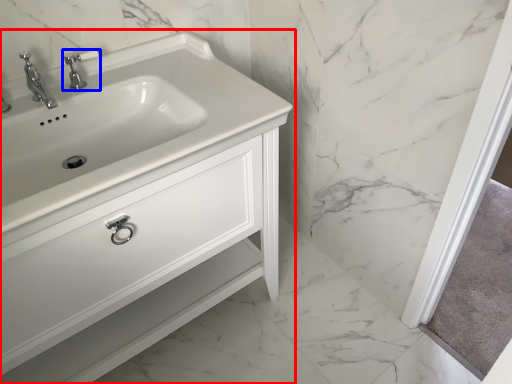
Question: Which of the following is the closest to the observer, bathroom cabinet (highlighted by a red box) or tap (highlighted by a blue box)?

Choices:
 (A) bathroom cabinet
 (B) tap

Answer: (A)